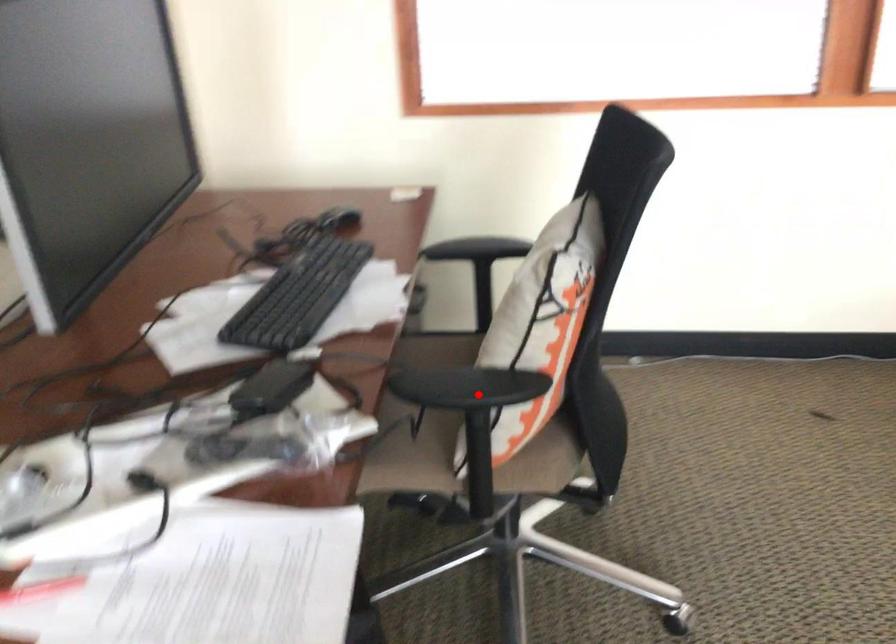
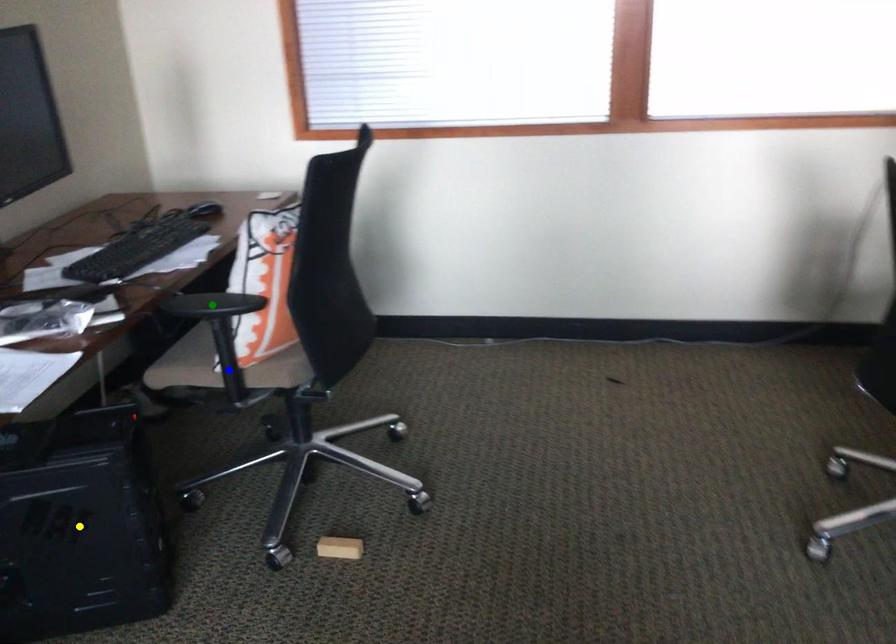
Question: I am providing you with two images of the same scene from different viewpoints. A red point is marked on the first image. You are given multiple points on the second image. In image 2, which mark is for the same physical point as the one in image 1?

Choices:
 (A) green point
 (B) blue point
 (C) yellow point

Answer: (A)